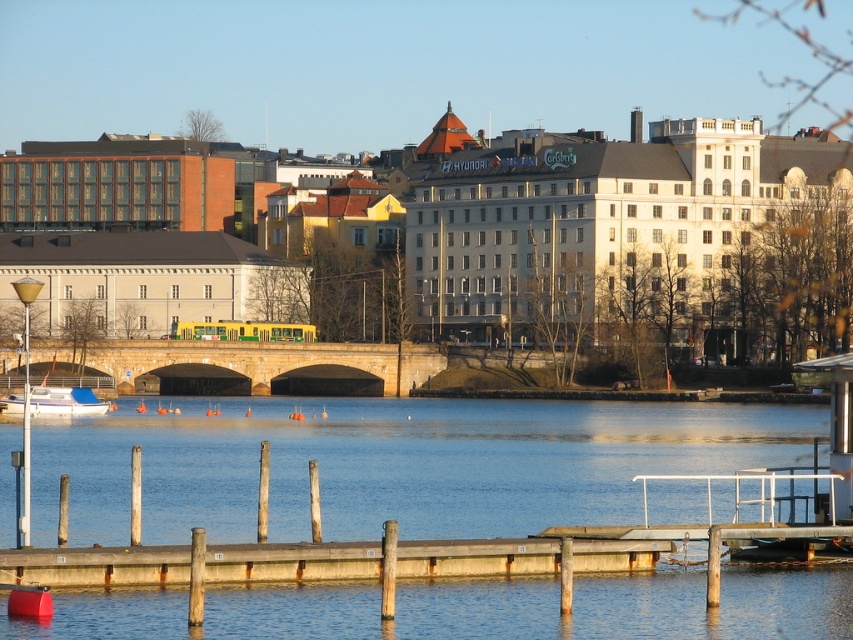
You are standing on the wooden dock and looking towards the stone bridge. You notice the blue water at lower center and the white matte boat at lower left. Which object appears taller from your viewpoint?

The blue water at lower center appears taller than the white matte boat at lower left because the blue water at lower center has a greater height compared to the white matte boat at lower left.

In the scene shown: You are standing at the point marked by coordinates point (96,564) in the image. What object are you standing on?

The point (96,564) indicates wooden dock at lower center, so you are standing on the wooden dock at lower center.